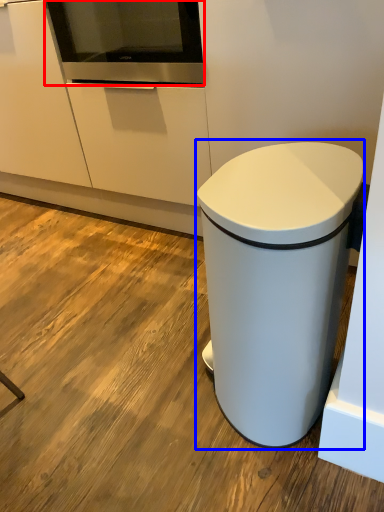
Question: Which object appears closest to the camera in this image, home appliance (highlighted by a red box) or waste container (highlighted by a blue box)?

Choices:
 (A) home appliance
 (B) waste container

Answer: (B)